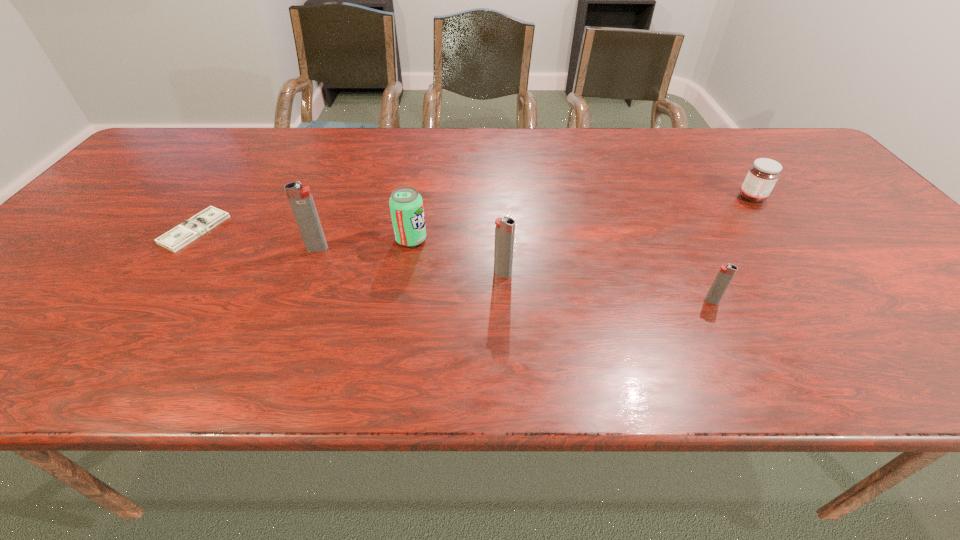
Where is `vacant region between the leftmost object and the second object from left to right`? vacant region between the leftmost object and the second object from left to right is located at coordinates (256, 239).

Identify the location of vacant region between the shortest object and the farthest igniter. The width and height of the screenshot is (960, 540). (256, 239).

This screenshot has height=540, width=960. Identify the location of free spot between the second shortest igniter and the shortest igniter. (607, 287).

Point out which object is positioned as the second nearest to the leftmost object. Please provide its 2D coordinates. Your answer should be formatted as a tuple, i.e. [(x, y)], where the tuple contains the x and y coordinates of a point satisfying the conditions above.

[(406, 205)]

Locate an element on the screen. This screenshot has width=960, height=540. the second closest object to the second object from right to left is located at coordinates (504, 228).

Select which igniter appears as the third closest to the jam. Please provide its 2D coordinates. Your answer should be formatted as a tuple, i.e. [(x, y)], where the tuple contains the x and y coordinates of a point satisfying the conditions above.

[(301, 201)]

Locate which igniter ranks second in proximity to the leftmost object. Please provide its 2D coordinates. Your answer should be formatted as a tuple, i.e. [(x, y)], where the tuple contains the x and y coordinates of a point satisfying the conditions above.

[(504, 228)]

The height and width of the screenshot is (540, 960). I want to click on free region that satisfies the following two spatial constraints: 1. on the front-facing side of the fourth object from right to left; 2. on the right side of the second farthest igniter, so click(405, 273).

The image size is (960, 540). Find the location of `vacant space that satisfies the following two spatial constraints: 1. on the front-facing side of the pop soda; 2. on the right side of the nearest object`. vacant space that satisfies the following two spatial constraints: 1. on the front-facing side of the pop soda; 2. on the right side of the nearest object is located at coordinates (400, 301).

Find the location of `free location that satisfies the following two spatial constraints: 1. on the front-facing side of the third object from left to right; 2. on the back side of the nearest object`. free location that satisfies the following two spatial constraints: 1. on the front-facing side of the third object from left to right; 2. on the back side of the nearest object is located at coordinates (400, 301).